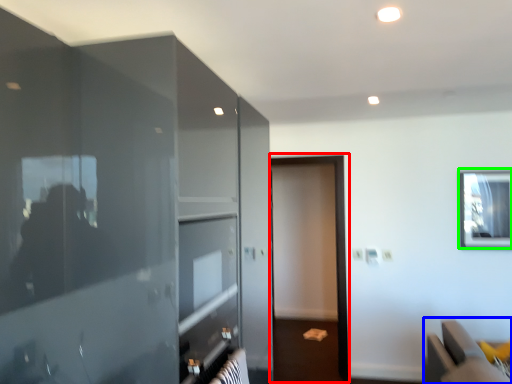
Question: Estimate the real-world distances between objects in this image. Which object is closer to screen door (highlighted by a red box), furniture (highlighted by a blue box) or window (highlighted by a green box)?

Choices:
 (A) furniture
 (B) window

Answer: (B)